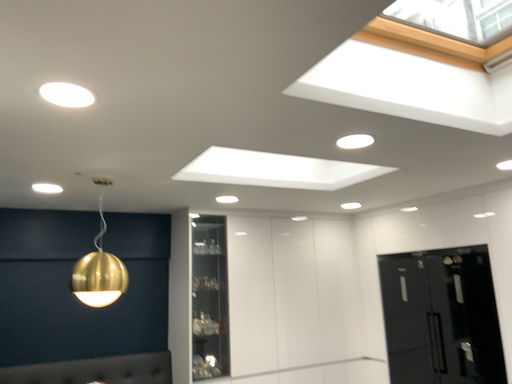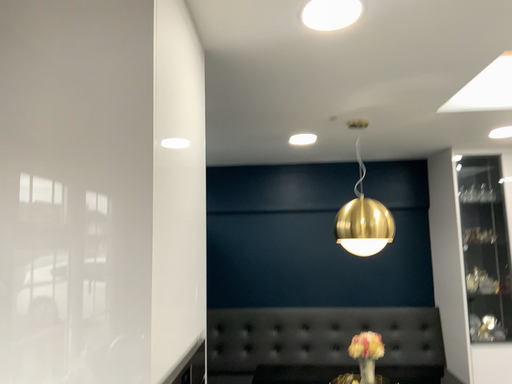
Question: How did the camera likely rotate when shooting the video?

Choices:
 (A) rotated right
 (B) rotated left

Answer: (B)